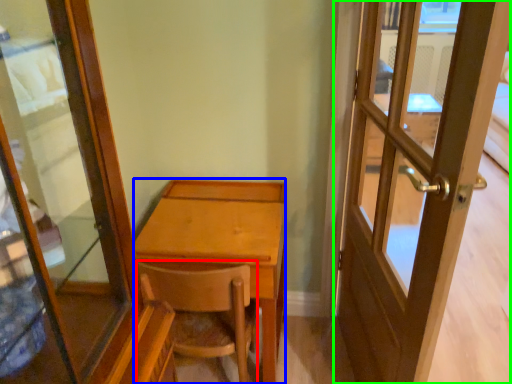
Question: Which object is the closest to the chair (highlighted by a red box)? Choose among these: desk (highlighted by a blue box) or door (highlighted by a green box).

Choices:
 (A) desk
 (B) door

Answer: (A)